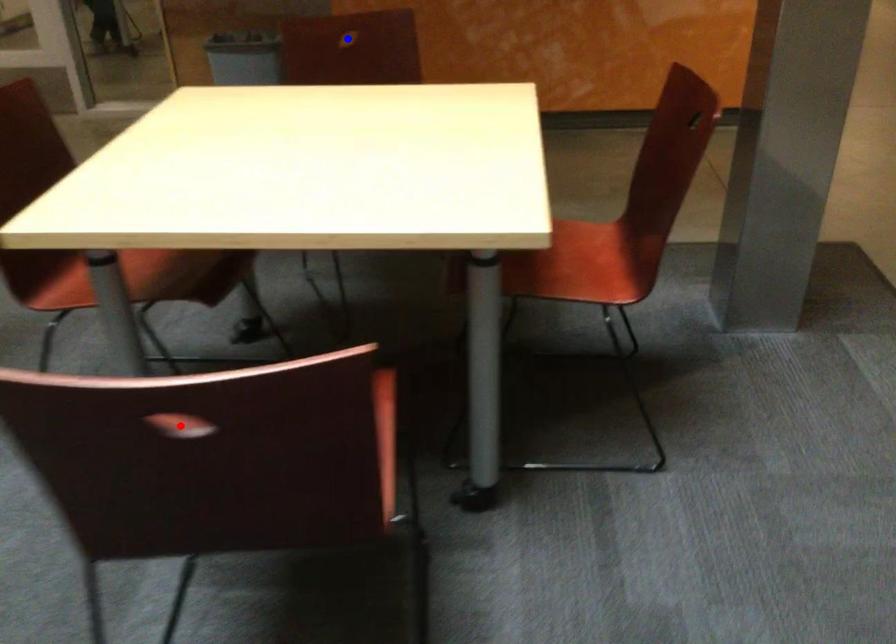
Question: Two points are marked on the image. Which point is closer to the camera?

Choices:
 (A) Blue point is closer.
 (B) Red point is closer.

Answer: (B)